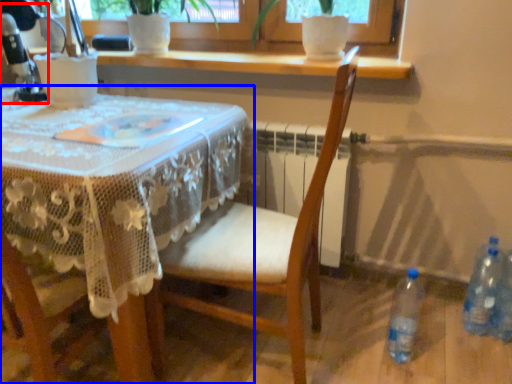
Question: Which point is further to the camera, sewing machine (highlighted by a red box) or table (highlighted by a blue box)?

Choices:
 (A) sewing machine
 (B) table

Answer: (A)